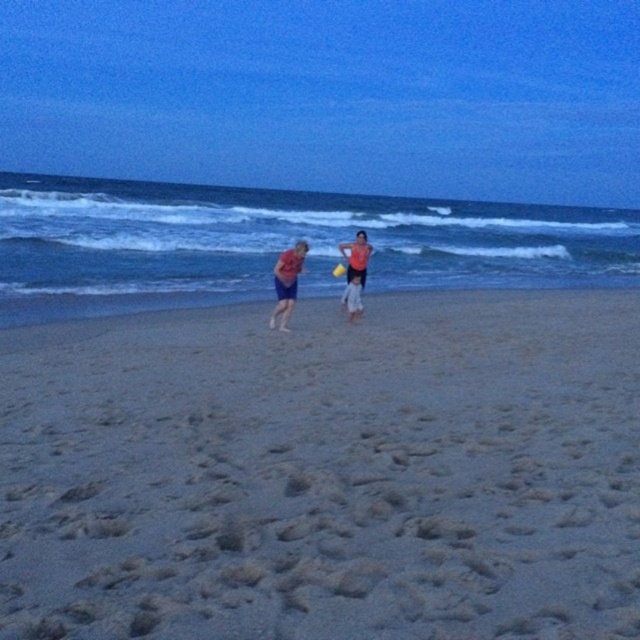
Question: Can you confirm if matte pink shirt at center is positioned below matte blue shorts at center?

Choices:
 (A) yes
 (B) no

Answer: (A)

Question: Observing the image, what is the correct spatial positioning of matte pink shirt at center in reference to matte pink shorts at center?

Choices:
 (A) right
 (B) left

Answer: (B)

Question: Which point appears farthest from the camera in this image?

Choices:
 (A) (355, 310)
 (B) (134, 568)
 (C) (307, 243)
 (D) (346, 268)

Answer: (D)

Question: Estimate the real-world distances between objects in this image. Which object is closer to the matte pink shorts at center?

Choices:
 (A) matte pink shirt at center
 (B) yellow plastic frisbee at center
 (C) fine-grained sand at center

Answer: (B)

Question: Which point is closer to the camera?

Choices:
 (A) fine-grained sand at center
 (B) matte pink shorts at center
 (C) matte pink shirt at center

Answer: (A)

Question: Does matte pink shorts at center appear under yellow plastic frisbee at center?

Choices:
 (A) yes
 (B) no

Answer: (A)